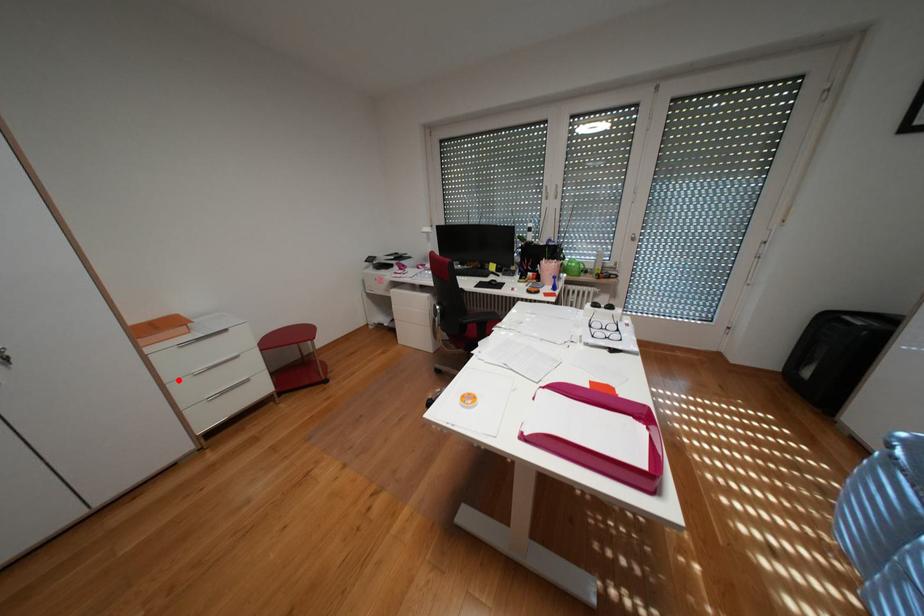
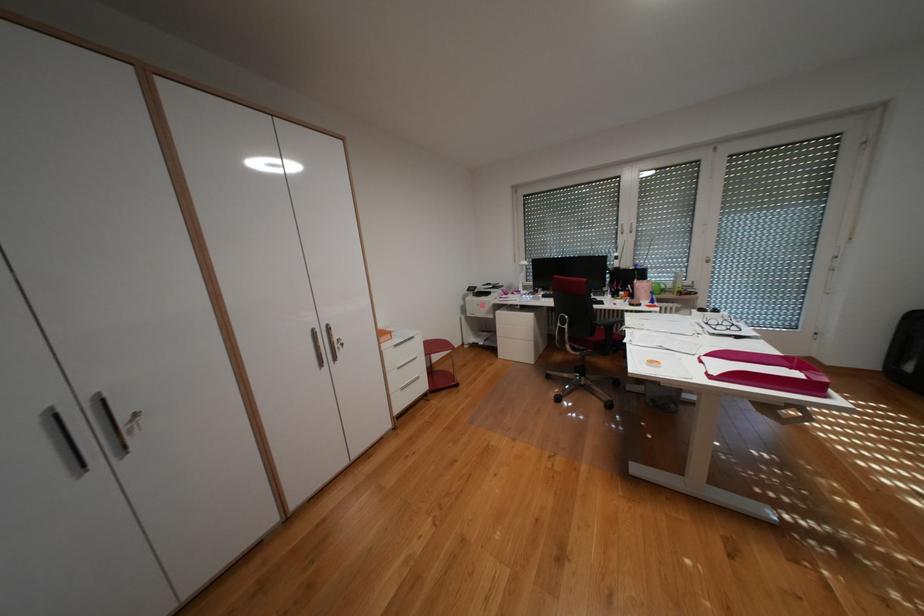
In the second image, find the point that corresponds to the highlighted location in the first image.

(399, 370)